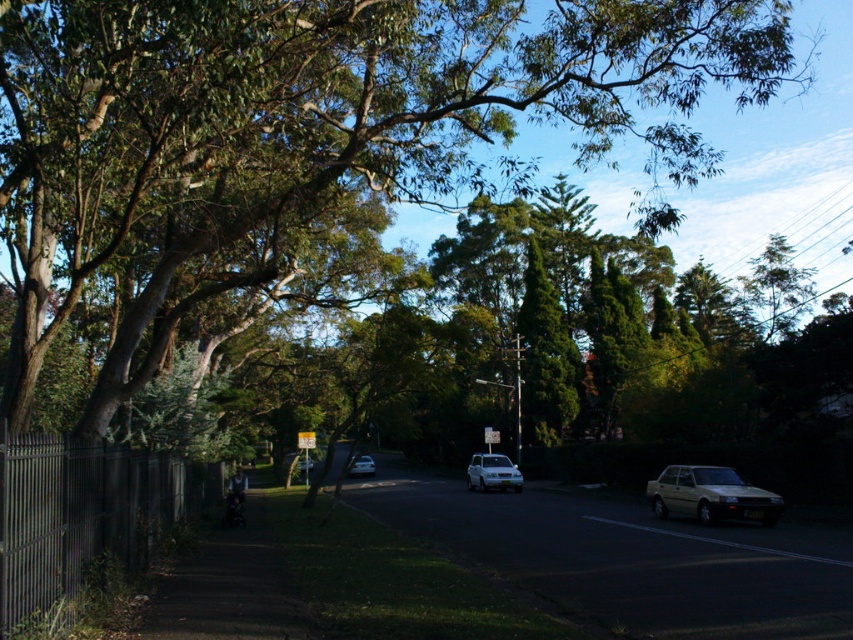
Question: Does dark gray metal fence at left have a larger size compared to white matte car at center?

Choices:
 (A) yes
 (B) no

Answer: (A)

Question: Does silver metallic sedan at center appear over metallic rectangular sign at center?

Choices:
 (A) no
 (B) yes

Answer: (A)

Question: Which object is closer to the camera taking this photo?

Choices:
 (A) silver metallic sedan at center
 (B) dark gray metal fence at left
 (C) yellow plastic sign at center

Answer: (B)

Question: Which point appears farthest from the camera in this image?

Choices:
 (A) (9, 554)
 (B) (495, 458)
 (C) (489, 442)

Answer: (C)

Question: Is white matte car at center below metallic silver sedan at center?

Choices:
 (A) no
 (B) yes

Answer: (A)

Question: Among these objects, which one is nearest to the camera?

Choices:
 (A) gold metallic sedan at right
 (B) dark gray metal fence at left

Answer: (B)